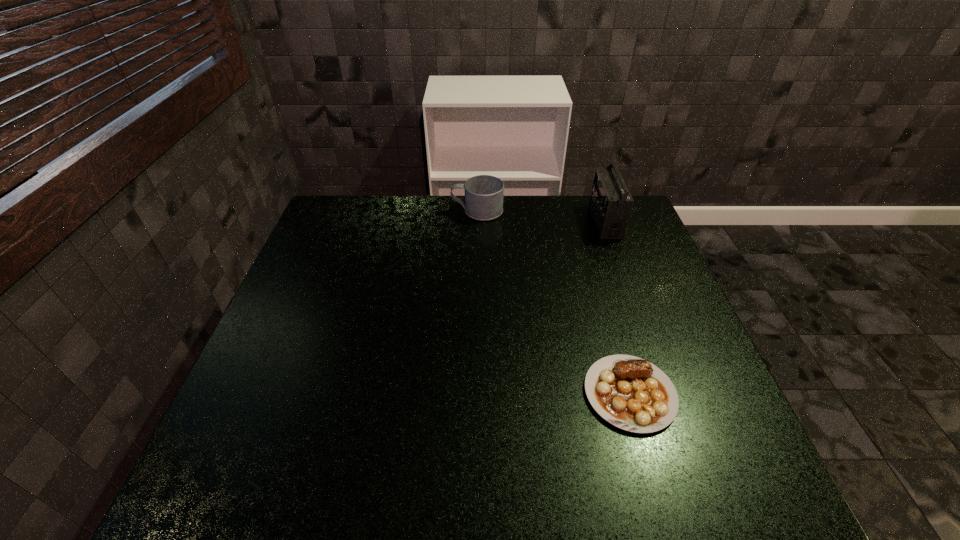
At what (x,y) coordinates should I click in order to perform the action: click on radio receiver. Please return your answer as a coordinate pair (x, y). Looking at the image, I should click on (611, 203).

Locate an element on the screen. This screenshot has width=960, height=540. the second tallest object is located at coordinates (483, 194).

Where is `the leftmost object`? The height and width of the screenshot is (540, 960). the leftmost object is located at coordinates (483, 194).

Identify the location of steak. (631, 393).

Identify the location of the shortest object. Image resolution: width=960 pixels, height=540 pixels. (631, 393).

The width and height of the screenshot is (960, 540). Identify the location of vacant point located 0.220m on the front panel of the radio receiver. (525, 221).

You are a GUI agent. You are given a task and a screenshot of the screen. Output one action in this format:
    pyautogui.click(x=<x>, y=<y>)
    Task: Click on the free space located on the front panel of the radio receiver
    This screenshot has height=540, width=960.
    Given the screenshot: What is the action you would take?
    pyautogui.click(x=481, y=221)

This screenshot has width=960, height=540. I want to click on vacant space positioned on the front panel of the radio receiver, so click(488, 221).

Find the location of `vacant area situated on the side of the second tallest object with the handle`. vacant area situated on the side of the second tallest object with the handle is located at coordinates (403, 211).

Image resolution: width=960 pixels, height=540 pixels. Find the location of `vacant region located on the side of the second tallest object with the handle`. vacant region located on the side of the second tallest object with the handle is located at coordinates pyautogui.click(x=334, y=211).